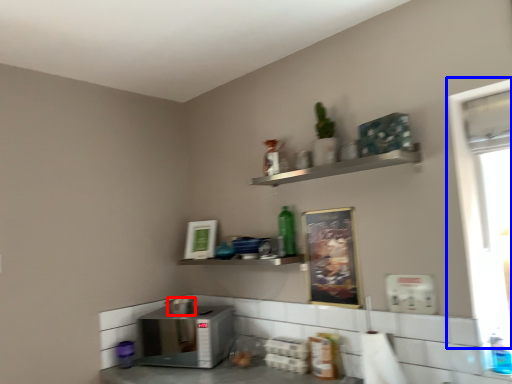
Question: Which of the following is the farthest to the observer, appliance (highlighted by a red box) or window screen (highlighted by a blue box)?

Choices:
 (A) appliance
 (B) window screen

Answer: (A)